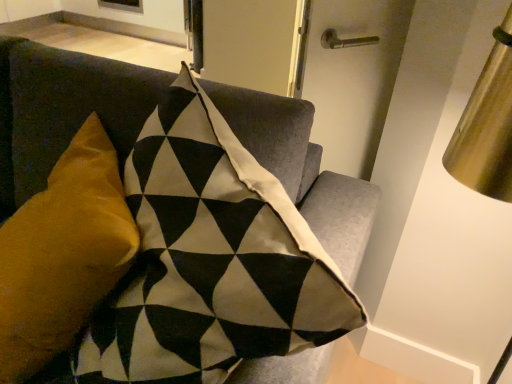
Question: From a real-world perspective, is velvet mustard pillow at left on velvet cushion at upper left?

Choices:
 (A) yes
 (B) no

Answer: (A)

Question: From the image's perspective, does velvet mustard pillow at left appear higher than velvet cushion at upper left?

Choices:
 (A) yes
 (B) no

Answer: (A)

Question: Does velvet mustard pillow at left have a greater height compared to velvet cushion at upper left?

Choices:
 (A) yes
 (B) no

Answer: (B)

Question: Can you confirm if velvet mustard pillow at left is positioned to the left of velvet cushion at upper left?

Choices:
 (A) yes
 (B) no

Answer: (B)

Question: Is velvet mustard pillow at left not near velvet cushion at upper left?

Choices:
 (A) yes
 (B) no

Answer: (B)

Question: Can velvet cushion at upper left be found inside velvet mustard pillow at left?

Choices:
 (A) no
 (B) yes

Answer: (A)

Question: Is velvet mustard pillow at left at the back of velvet cushion at upper left?

Choices:
 (A) no
 (B) yes

Answer: (B)

Question: From a real-world perspective, is velvet cushion at upper left on velvet mustard pillow at left?

Choices:
 (A) no
 (B) yes

Answer: (A)

Question: Does velvet cushion at upper left have a smaller size compared to velvet mustard pillow at left?

Choices:
 (A) no
 (B) yes

Answer: (A)

Question: Is velvet cushion at upper left further to the viewer compared to velvet mustard pillow at left?

Choices:
 (A) yes
 (B) no

Answer: (B)

Question: Can you see velvet cushion at upper left touching velvet mustard pillow at left?

Choices:
 (A) no
 (B) yes

Answer: (A)

Question: Is velvet cushion at upper left not inside velvet mustard pillow at left?

Choices:
 (A) no
 (B) yes

Answer: (B)

Question: Would you say velvet cushion at upper left is inside or outside velvet mustard pillow at left?

Choices:
 (A) inside
 (B) outside

Answer: (B)